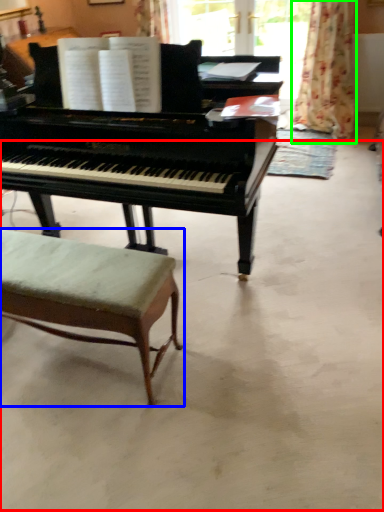
Question: Which object is positioned closest to concrete (highlighted by a red box)? Select from stool (highlighted by a blue box) and curtain (highlighted by a green box).

Choices:
 (A) stool
 (B) curtain

Answer: (A)